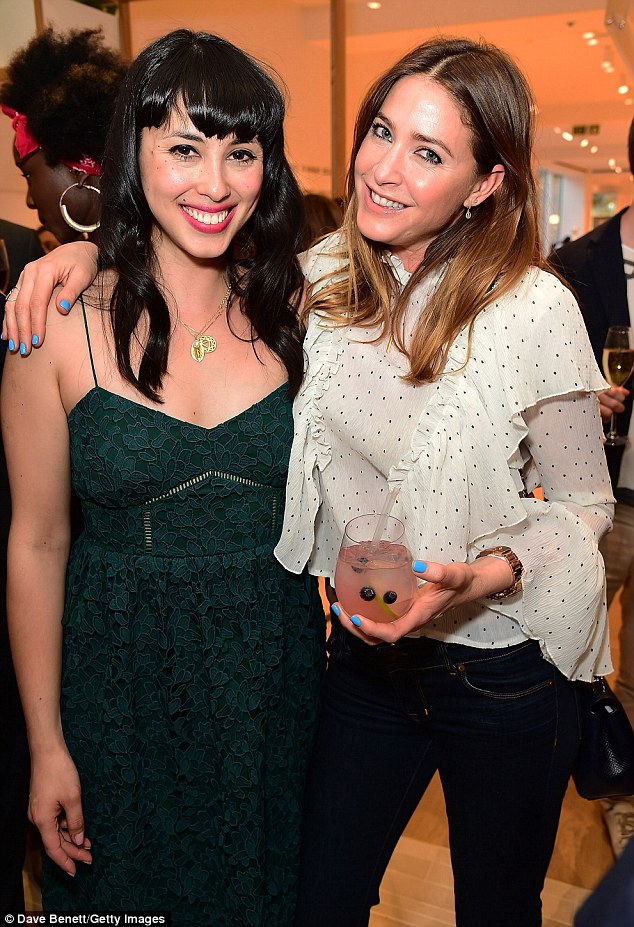
You are a GUI agent. You are given a task and a screenshot of the screen. Output one action in this format:
    pyautogui.click(x=<x>, y=<y>)
    Task: Click on the ceiling
    This screenshot has height=927, width=634.
    Given the screenshot: What is the action you would take?
    pyautogui.click(x=570, y=72)